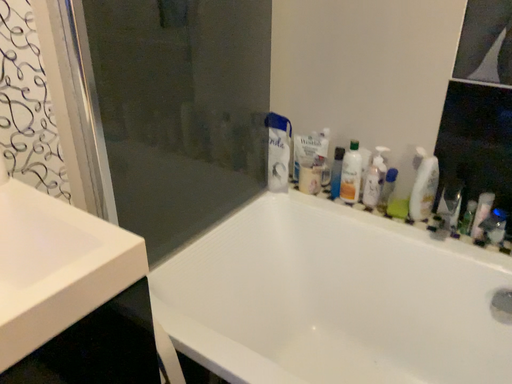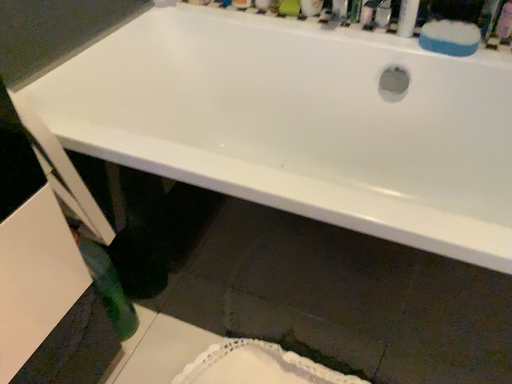
Question: Which way did the camera rotate in the video?

Choices:
 (A) rotated upward
 (B) rotated downward

Answer: (B)